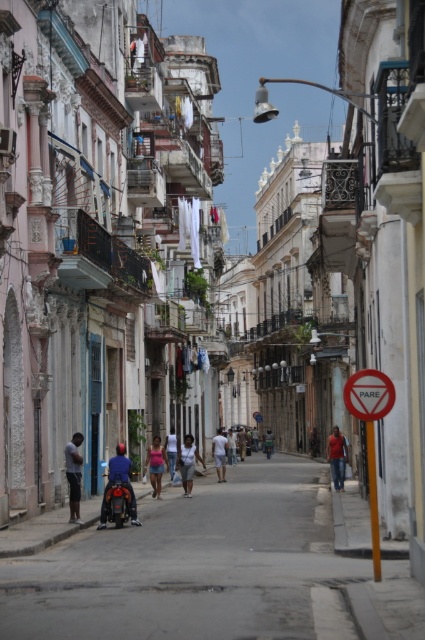
You are a photographer trying to capture both the dark gray shirt at center and the green fabric shirt at center in a single shot. Given their sizes, which shirt would you need to position closer to the camera to ensure both fit in the frame?

The dark gray shirt at center occupies less space than the green fabric shirt at center, so you should position the dark gray shirt at center closer to the camera to balance their sizes in the frame.

You are a tourist in this historic area and want to take a photo of the dark gray shirt at center. Where should you position yourself to capture it in the frame?

Position yourself at point (73, 474) to capture the dark gray shirt at center in the frame.